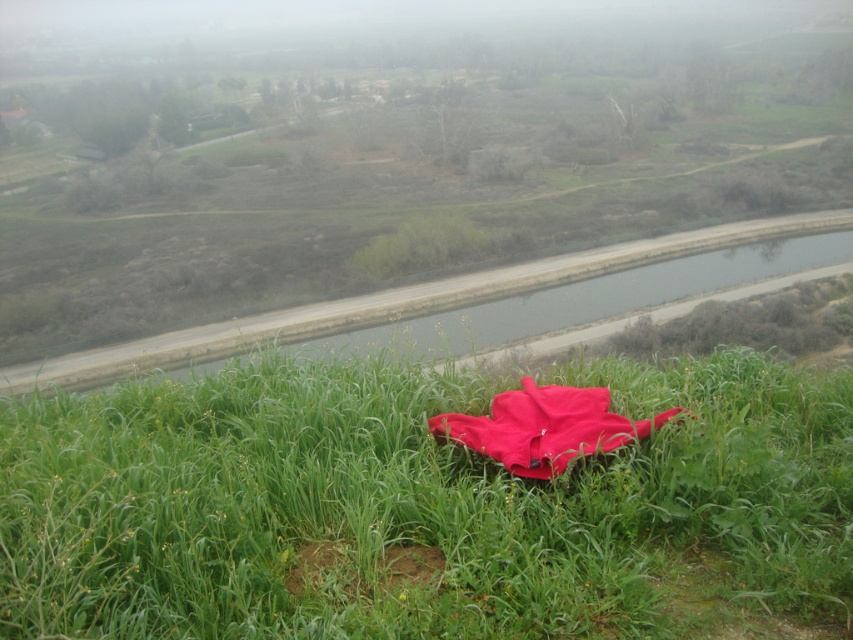
Question: Is matte red fabric at center further to camera compared to smooth concrete river at center?

Choices:
 (A) yes
 (B) no

Answer: (B)

Question: Which of the following is the farthest from the observer?

Choices:
 (A) matte red fabric at center
 (B) matte red blanket at center
 (C) smooth concrete river at center

Answer: (C)

Question: Which point is farther to the camera?

Choices:
 (A) brown dirt patch at lower center
 (B) matte red blanket at center
 (C) smooth concrete river at center

Answer: (C)

Question: From the image, what is the correct spatial relationship of matte red blanket at center in relation to brown dirt patch at lower center?

Choices:
 (A) below
 (B) above

Answer: (B)

Question: Based on their relative distances, which object is farther from the smooth concrete river at center?

Choices:
 (A) brown dirt patch at lower center
 (B) matte red fabric at center

Answer: (B)

Question: Is the position of matte red fabric at center less distant than that of matte red blanket at center?

Choices:
 (A) yes
 (B) no

Answer: (A)